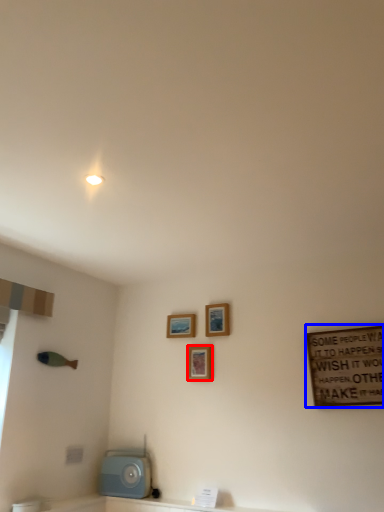
Question: Which object appears closest to the camera in this image, picture frame (highlighted by a red box) or bulletin board (highlighted by a blue box)?

Choices:
 (A) picture frame
 (B) bulletin board

Answer: (B)